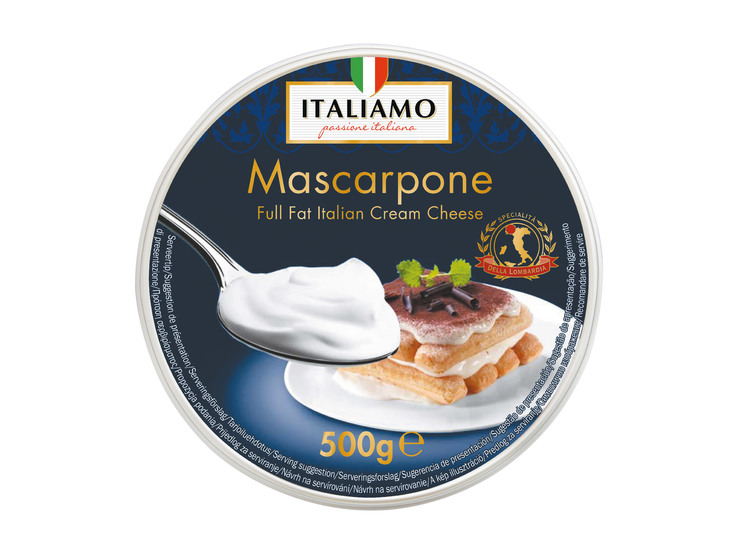
Image resolution: width=738 pixels, height=554 pixels. I want to click on empty left side of white plate, so click(288, 378).